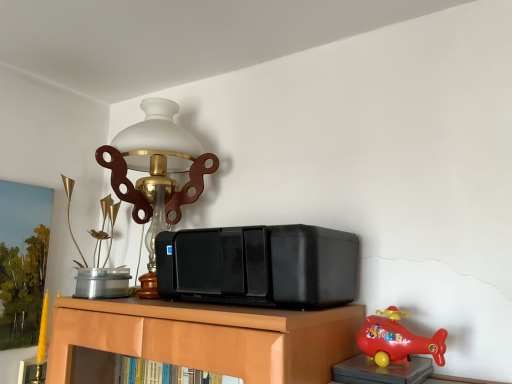
The height and width of the screenshot is (384, 512). What do you see at coordinates (99, 257) in the screenshot? I see `metallic gold vase at upper left, which is counted as the second toy, starting from the right` at bounding box center [99, 257].

Measure the distance between metallic gold vase at upper left, the 2th toy from the front, and camera.

A distance of 4.62 feet exists between metallic gold vase at upper left, the 2th toy from the front, and camera.

This screenshot has width=512, height=384. Describe the element at coordinates (259, 266) in the screenshot. I see `black plastic stereo at center` at that location.

This screenshot has width=512, height=384. Describe the element at coordinates (157, 162) in the screenshot. I see `matte brass lamp at upper left` at that location.

Image resolution: width=512 pixels, height=384 pixels. What are the coordinates of `metallic gold vase at upper left, which is counted as the second toy, starting from the right` in the screenshot? It's located at (99, 257).

From a real-world perspective, is rubberized red helicopter at lower right, the second toy viewed from the left, positioned above or below black plastic stereo at center?

Clearly, from a real-world perspective, rubberized red helicopter at lower right, the second toy viewed from the left, is below black plastic stereo at center.

Can you confirm if rubberized red helicopter at lower right, the second toy viewed from the left, is bigger than black plastic stereo at center?

No.

From the image's perspective, is rubberized red helicopter at lower right, the second toy viewed from the back, located above or below black plastic stereo at center?

From the image's perspective, rubberized red helicopter at lower right, the second toy viewed from the back, appears below black plastic stereo at center.

Which point is more distant from viewer, (88, 277) or (390, 338)?

The point (88, 277) is more distant.

Is metallic gold vase at upper left, the 2th toy from the front, at the right side of rubberized red helicopter at lower right, the second toy viewed from the left?

In fact, metallic gold vase at upper left, the 2th toy from the front, is to the left of rubberized red helicopter at lower right, the second toy viewed from the left.

Considering the sizes of objects metallic gold vase at upper left, which is counted as the second toy, starting from the right, and rubberized red helicopter at lower right, arranged as the 1th toy when viewed from the right, in the image provided, who is thinner, metallic gold vase at upper left, which is counted as the second toy, starting from the right, or rubberized red helicopter at lower right, arranged as the 1th toy when viewed from the right,?

With smaller width is rubberized red helicopter at lower right, arranged as the 1th toy when viewed from the right.

Identify the location of toy on the right of metallic gold vase at upper left, which is counted as the second toy, starting from the right. The image size is (512, 384). (397, 340).

This screenshot has height=384, width=512. I want to click on lamp positioned vertically above the black plastic stereo at center (from a real-world perspective), so click(x=157, y=162).

From a real-world perspective, which object stands above the other?

matte brass lamp at upper left.

Is black plastic stereo at center taller than matte brass lamp at upper left?

No.

Can we say black plastic stereo at center lies outside matte brass lamp at upper left?

black plastic stereo at center lies outside matte brass lamp at upper left's area.

Is rubberized red helicopter at lower right, the second toy viewed from the left, turned away from metallic gold vase at upper left, which is the 1th toy in left-to-right order?

rubberized red helicopter at lower right, the second toy viewed from the left, is not turned away from metallic gold vase at upper left, which is the 1th toy in left-to-right order.

In terms of height, does rubberized red helicopter at lower right, the second toy viewed from the left, look taller or shorter compared to metallic gold vase at upper left, which appears as the first toy when viewed from the back?

rubberized red helicopter at lower right, the second toy viewed from the left, is shorter than metallic gold vase at upper left, which appears as the first toy when viewed from the back.

Is rubberized red helicopter at lower right, the second toy viewed from the back, far away from metallic gold vase at upper left, which is counted as the second toy, starting from the right?

No, rubberized red helicopter at lower right, the second toy viewed from the back, is not far away from metallic gold vase at upper left, which is counted as the second toy, starting from the right.

Visually, is rubberized red helicopter at lower right, the second toy viewed from the left, positioned to the left or to the right of metallic gold vase at upper left, which is the 1th toy in left-to-right order?

In the image, rubberized red helicopter at lower right, the second toy viewed from the left, appears on the right side of metallic gold vase at upper left, which is the 1th toy in left-to-right order.

Based on the photo, measure the distance from black plastic stereo at center to rubberized red helicopter at lower right, the first toy when ordered from front to back.

The distance of black plastic stereo at center from rubberized red helicopter at lower right, the first toy when ordered from front to back, is 9.46 inches.

Looking at this image, does black plastic stereo at center come in front of rubberized red helicopter at lower right, the second toy viewed from the back?

No, it is not.

Based on the photo, which of these two, black plastic stereo at center or rubberized red helicopter at lower right, the second toy viewed from the left, stands shorter?

rubberized red helicopter at lower right, the second toy viewed from the left, is shorter.

Considering the relative positions of black plastic stereo at center and rubberized red helicopter at lower right, the first toy when ordered from front to back, in the image provided, is black plastic stereo at center to the left of rubberized red helicopter at lower right, the first toy when ordered from front to back, from the viewer's perspective?

Yes, black plastic stereo at center is to the left of rubberized red helicopter at lower right, the first toy when ordered from front to back.

Does metallic gold vase at upper left, which appears as the first toy when viewed from the back, have a greater height compared to black plastic stereo at center?

Indeed, metallic gold vase at upper left, which appears as the first toy when viewed from the back, has a greater height compared to black plastic stereo at center.

Is metallic gold vase at upper left, which is the 1th toy in left-to-right order, to the left or to the right of black plastic stereo at center in the image?

From the image, it's evident that metallic gold vase at upper left, which is the 1th toy in left-to-right order, is to the left of black plastic stereo at center.

Is point (109, 296) closer or farther from the camera than point (285, 278)?

Point (109, 296).

Is metallic gold vase at upper left, which is counted as the second toy, starting from the right, positioned before black plastic stereo at center?

No, it is not.

Is metallic gold vase at upper left, which appears as the first toy when viewed from the back, behind matte brass lamp at upper left?

Yes, it is behind matte brass lamp at upper left.

Considering the relative sizes of metallic gold vase at upper left, the 2th toy from the front, and matte brass lamp at upper left in the image provided, is metallic gold vase at upper left, the 2th toy from the front, thinner than matte brass lamp at upper left?

Correct, the width of metallic gold vase at upper left, the 2th toy from the front, is less than that of matte brass lamp at upper left.

Is matte brass lamp at upper left inside metallic gold vase at upper left, which is counted as the second toy, starting from the right?

Definitely not — matte brass lamp at upper left is not inside metallic gold vase at upper left, which is counted as the second toy, starting from the right.

From a real-world perspective, which is physically below, metallic gold vase at upper left, the 2th toy from the front, or matte brass lamp at upper left?

metallic gold vase at upper left, the 2th toy from the front, is physically lower.

Where is `stereo located on the left of rubberized red helicopter at lower right, the second toy viewed from the back`? stereo located on the left of rubberized red helicopter at lower right, the second toy viewed from the back is located at coordinates (259, 266).

Identify the location of toy in front of the metallic gold vase at upper left, the 2th toy from the front. The image size is (512, 384). (397, 340).

Based on the photo, looking at the image, which one is located closer to matte brass lamp at upper left, black plastic stereo at center or metallic gold vase at upper left, which is the 1th toy in left-to-right order?

Based on the image, black plastic stereo at center appears to be nearer to matte brass lamp at upper left.

Estimate the real-world distances between objects in this image. Which object is further from rubberized red helicopter at lower right, the first toy when ordered from front to back, black plastic stereo at center or metallic gold vase at upper left, which appears as the first toy when viewed from the back?

metallic gold vase at upper left, which appears as the first toy when viewed from the back, lies further to rubberized red helicopter at lower right, the first toy when ordered from front to back, than the other object.

Based on their spatial positions, is metallic gold vase at upper left, which is counted as the second toy, starting from the right, or matte brass lamp at upper left further from rubberized red helicopter at lower right, the second toy viewed from the left?

Based on the image, metallic gold vase at upper left, which is counted as the second toy, starting from the right, appears to be further to rubberized red helicopter at lower right, the second toy viewed from the left.

Looking at the image, which one is located further to rubberized red helicopter at lower right, the second toy viewed from the back, matte brass lamp at upper left or black plastic stereo at center?

matte brass lamp at upper left lies further to rubberized red helicopter at lower right, the second toy viewed from the back, than the other object.

When comparing their distances from matte brass lamp at upper left, does black plastic stereo at center or rubberized red helicopter at lower right, the second toy viewed from the back, seem further?

rubberized red helicopter at lower right, the second toy viewed from the back.

Looking at this image, estimate the real-world distances between objects in this image. Which object is closer to metallic gold vase at upper left, which is the 1th toy in left-to-right order, rubberized red helicopter at lower right, the second toy viewed from the back, or matte brass lamp at upper left?

The object closer to metallic gold vase at upper left, which is the 1th toy in left-to-right order, is matte brass lamp at upper left.

When comparing their distances from black plastic stereo at center, does metallic gold vase at upper left, which is counted as the second toy, starting from the right, or rubberized red helicopter at lower right, the second toy viewed from the left, seem closer?

Among the two, rubberized red helicopter at lower right, the second toy viewed from the left, is located nearer to black plastic stereo at center.

Considering their positions, is matte brass lamp at upper left positioned closer to rubberized red helicopter at lower right, the first toy when ordered from front to back, than metallic gold vase at upper left, which is the 1th toy in left-to-right order?

matte brass lamp at upper left lies closer to rubberized red helicopter at lower right, the first toy when ordered from front to back, than the other object.

Where is `stereo situated between matte brass lamp at upper left and rubberized red helicopter at lower right, the second toy viewed from the back, from left to right`? Image resolution: width=512 pixels, height=384 pixels. stereo situated between matte brass lamp at upper left and rubberized red helicopter at lower right, the second toy viewed from the back, from left to right is located at coordinates (259, 266).

Locate an element on the screen. The height and width of the screenshot is (384, 512). lamp between metallic gold vase at upper left, which appears as the first toy when viewed from the back, and rubberized red helicopter at lower right, the second toy viewed from the left, from left to right is located at coordinates (157, 162).

This screenshot has width=512, height=384. Find the location of `stereo between metallic gold vase at upper left, which appears as the first toy when viewed from the back, and rubberized red helicopter at lower right, arranged as the 1th toy when viewed from the right, from left to right`. stereo between metallic gold vase at upper left, which appears as the first toy when viewed from the back, and rubberized red helicopter at lower right, arranged as the 1th toy when viewed from the right, from left to right is located at coordinates (259, 266).

This screenshot has width=512, height=384. In order to click on lamp between metallic gold vase at upper left, which is counted as the second toy, starting from the right, and black plastic stereo at center, in the horizontal direction in this screenshot , I will do `click(157, 162)`.